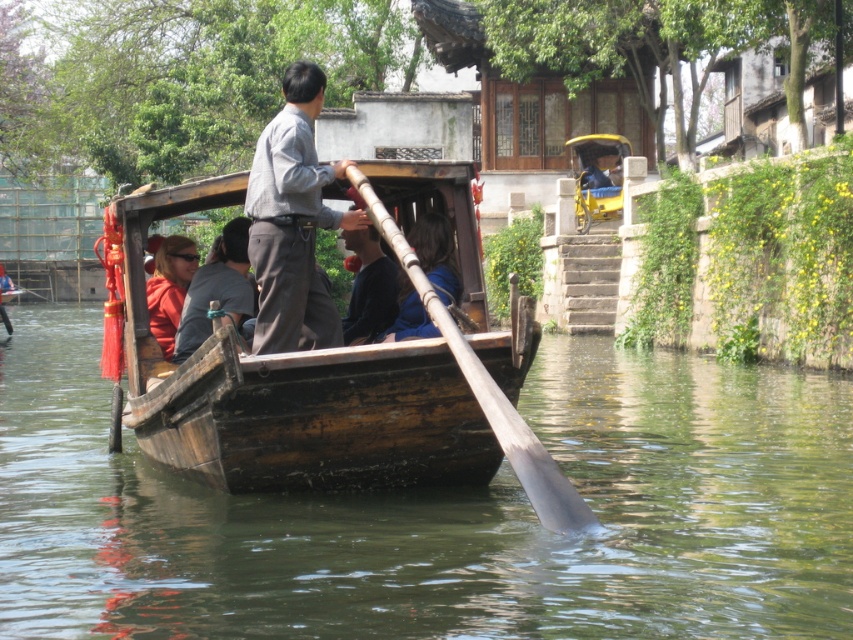
Between silver polished wood paddle at center and blue fabric at center, which one is positioned lower?

Positioned lower is silver polished wood paddle at center.

Does silver polished wood paddle at center have a lesser width compared to blue fabric at center?

No.

Is point (364, 196) closer to viewer compared to point (403, 330)?

Yes, it is.

Locate an element on the screen. The height and width of the screenshot is (640, 853). silver polished wood paddle at center is located at coordinates (488, 392).

Is brown wooden boat at center above dark blue fabric at center?

Actually, brown wooden boat at center is below dark blue fabric at center.

Who is positioned more to the right, brown wooden boat at center or dark blue fabric at center?

dark blue fabric at center is more to the right.

Is point (50, 413) farther from viewer compared to point (360, 324)?

Yes.

At what (x,y) coordinates should I click in order to perform the action: click on brown wooden boat at center. Please return your answer as a coordinate pair (x, y). Looking at the image, I should click on (440, 513).

Can you confirm if wooden boat at center is positioned to the right of orange fabric jacket at center?

Correct, you'll find wooden boat at center to the right of orange fabric jacket at center.

From the picture: Which of these two, wooden boat at center or orange fabric jacket at center, stands taller?

Standing taller between the two is orange fabric jacket at center.

Locate an element on the screen. wooden boat at center is located at coordinates (297, 397).

At what (x,y) coordinates should I click in order to perform the action: click on wooden boat at center. Please return your answer as a coordinate pair (x, y). This screenshot has width=853, height=640. Looking at the image, I should click on (297, 397).